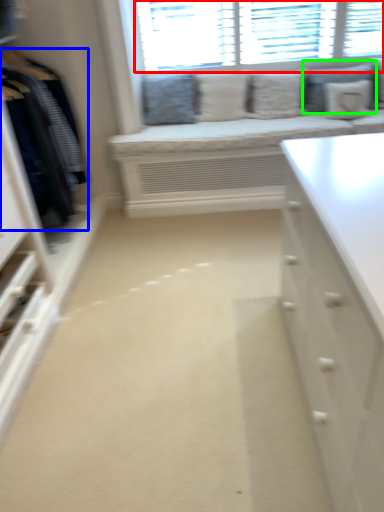
Question: Which is nearer to the window (highlighted by a red box)? clothing (highlighted by a blue box) or pillow (highlighted by a green box).

Choices:
 (A) clothing
 (B) pillow

Answer: (B)